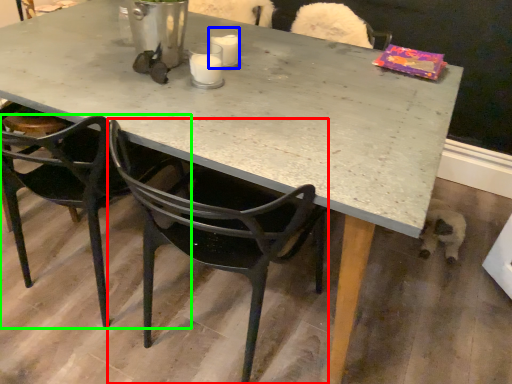
Question: Which object is the farthest from chair (highlighted by a red box)? Choose among these: coffee cup (highlighted by a blue box) or chair (highlighted by a green box).

Choices:
 (A) coffee cup
 (B) chair

Answer: (A)